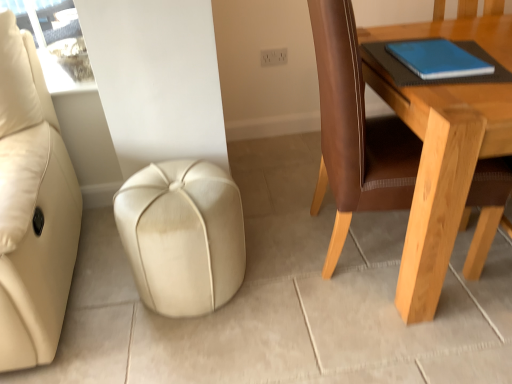
You are a GUI agent. You are given a task and a screenshot of the screen. Output one action in this format:
    pyautogui.click(x=<x>, y=<y>)
    Task: Click on the free space on the front side of beige leather ottoman at center
    The image size is (512, 384).
    Given the screenshot: What is the action you would take?
    pyautogui.click(x=179, y=351)